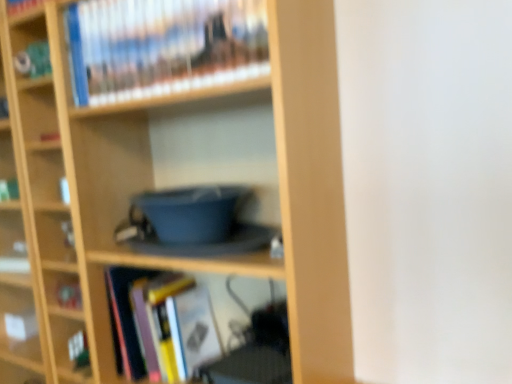
Question: Considering the relative sizes of hardcover book at upper center, which is counted as the 1th book, starting from the top, and hardcover book at center, acting as the third book starting from the top, in the image provided, is hardcover book at upper center, which is counted as the 1th book, starting from the top, shorter than hardcover book at center, acting as the third book starting from the top,?

Choices:
 (A) no
 (B) yes

Answer: (B)

Question: From a real-world perspective, is hardcover book at upper center, which is counted as the 1th book, starting from the top, located higher than hardcover book at center, acting as the third book starting from the top?

Choices:
 (A) yes
 (B) no

Answer: (A)

Question: Is hardcover book at upper center, marked as the third book in a bottom-to-top arrangement, positioned behind hardcover book at center, acting as the third book starting from the top?

Choices:
 (A) yes
 (B) no

Answer: (B)

Question: Is hardcover book at upper center, marked as the third book in a bottom-to-top arrangement, thinner than hardcover book at center, acting as the third book starting from the top?

Choices:
 (A) no
 (B) yes

Answer: (B)

Question: Is hardcover book at upper center, which is counted as the 1th book, starting from the top, touching hardcover book at center, acting as the third book starting from the top?

Choices:
 (A) no
 (B) yes

Answer: (A)

Question: From the image's perspective, is hardcover book at center, acting as the third book starting from the top, positioned above or below wooden bookcase at center?

Choices:
 (A) above
 (B) below

Answer: (B)

Question: Relative to wooden bookcase at center, is hardcover book at center, which is counted as the first book, starting from the bottom, in front or behind?

Choices:
 (A) front
 (B) behind

Answer: (B)

Question: In terms of height, does hardcover book at center, which is counted as the first book, starting from the bottom, look taller or shorter compared to wooden bookcase at center?

Choices:
 (A) short
 (B) tall

Answer: (A)

Question: From a real-world perspective, is hardcover book at center, which is counted as the first book, starting from the bottom, physically located above or below wooden bookcase at center?

Choices:
 (A) above
 (B) below

Answer: (B)

Question: In terms of height, does hardcover book at lower left, which ranks as the 2th book in bottom-to-top order, look taller or shorter compared to hardcover book at upper center, marked as the third book in a bottom-to-top arrangement?

Choices:
 (A) short
 (B) tall

Answer: (A)

Question: Does point (62, 299) appear closer or farther from the camera than point (243, 23)?

Choices:
 (A) farther
 (B) closer

Answer: (A)

Question: Considering their positions, is hardcover book at lower left, which ranks as the 2th book in bottom-to-top order, located in front of or behind hardcover book at upper center, which is counted as the 1th book, starting from the top?

Choices:
 (A) front
 (B) behind

Answer: (B)

Question: From a real-world perspective, is hardcover book at lower left, which is counted as the 2th book, starting from the top, above or below hardcover book at upper center, marked as the third book in a bottom-to-top arrangement?

Choices:
 (A) above
 (B) below

Answer: (B)

Question: From their relative heights in the image, would you say hardcover book at upper center, which is counted as the 1th book, starting from the top, is taller or shorter than wooden bookcase at center?

Choices:
 (A) tall
 (B) short

Answer: (B)

Question: Does point (207, 14) appear closer or farther from the camera than point (333, 271)?

Choices:
 (A) closer
 (B) farther

Answer: (A)